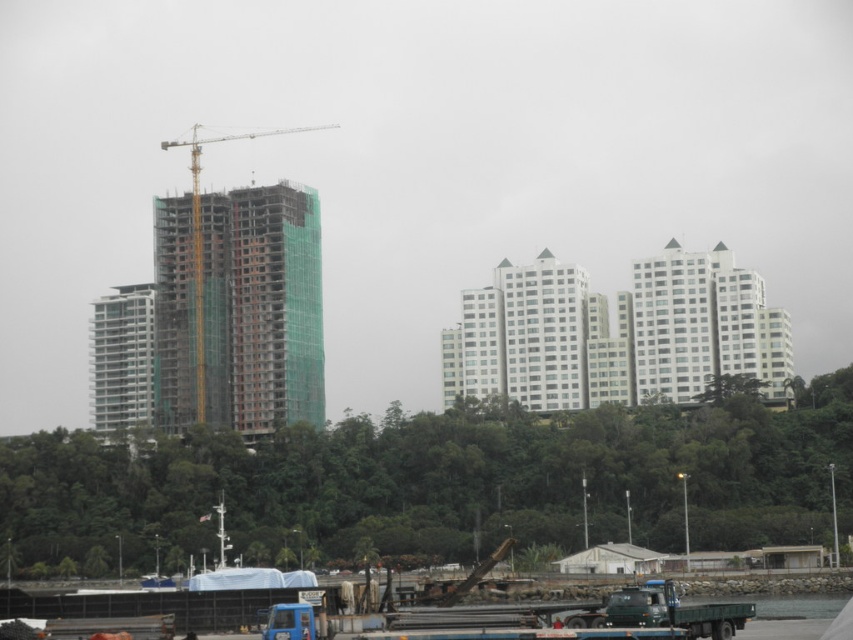
Is the position of green matte truck at lower center less distant than that of clear water at lower right?

Yes.

Does green matte truck at lower center have a greater height compared to clear water at lower right?

Indeed, green matte truck at lower center has a greater height compared to clear water at lower right.

Is point (724, 611) positioned in front of point (776, 611)?

Yes.

This screenshot has height=640, width=853. What are the coordinates of `green matte truck at lower center` in the screenshot? It's located at (664, 611).

Which of these two, metallic yellow crane at center-left or white glass building at left, stands shorter?

white glass building at left

Is point (175, 209) positioned behind point (140, 388)?

No.

Image resolution: width=853 pixels, height=640 pixels. Find the location of `metallic yellow crane at center-left`. metallic yellow crane at center-left is located at coordinates (239, 301).

Is white glass building at left thinner than clear water at lower right?

No, white glass building at left is not thinner than clear water at lower right.

At what (x,y) coordinates should I click in order to perform the action: click on white glass building at left. Please return your answer as a coordinate pair (x, y). Image resolution: width=853 pixels, height=640 pixels. Looking at the image, I should click on (122, 358).